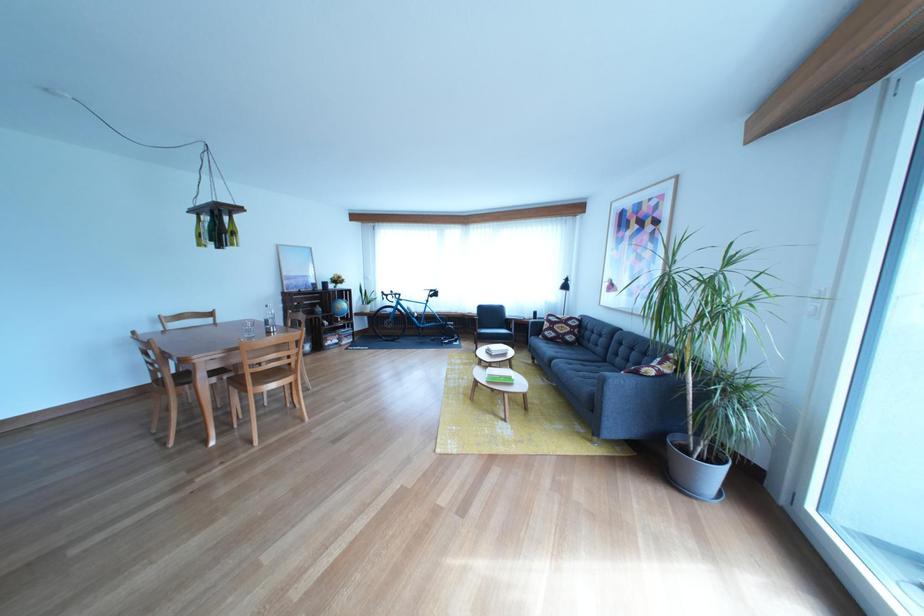
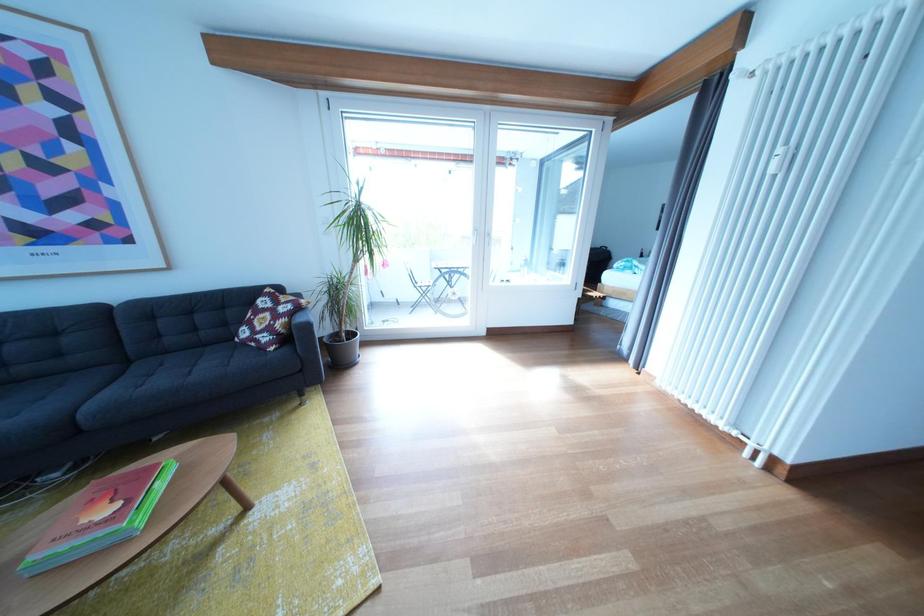
Find the pixel in the second image that matches point 618,368 in the first image.

(141, 368)